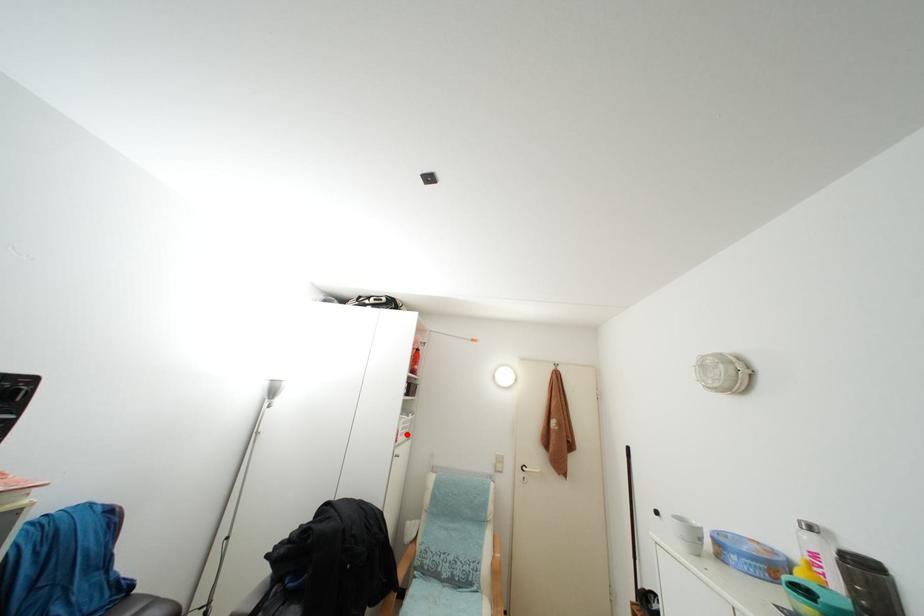
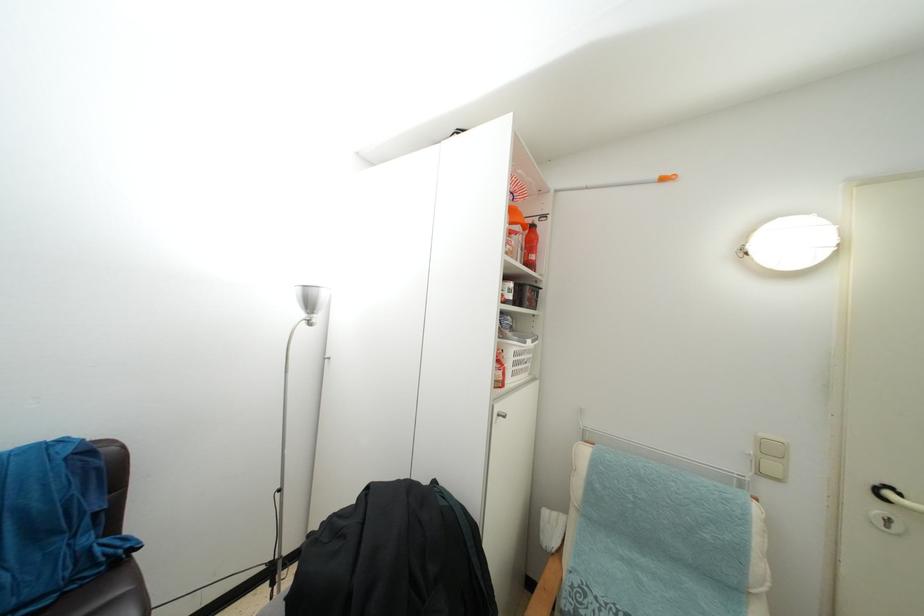
Find the pixel in the second image that matches the highlighted location in the first image.

(519, 370)